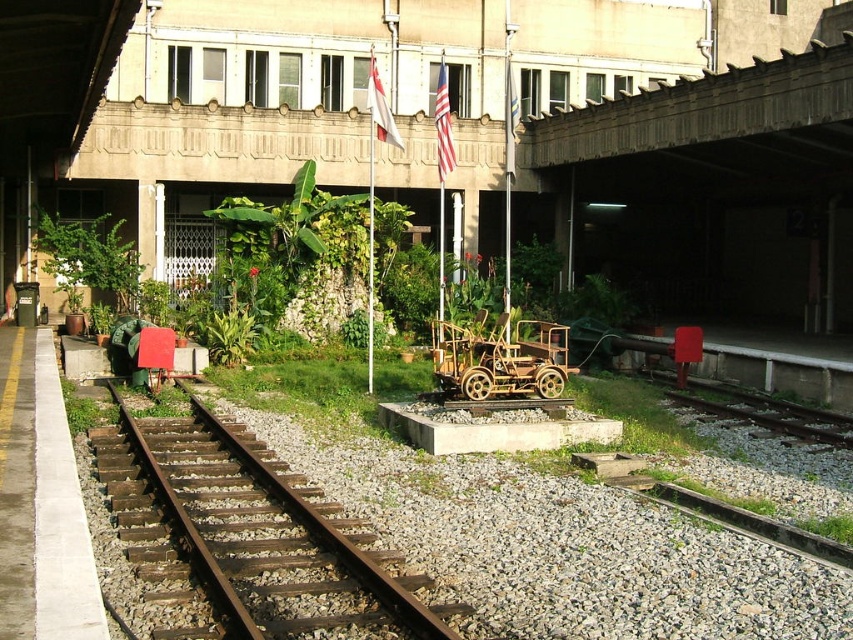
Is rusty metal train track at center positioned in front of concrete textured overpass at upper center?

Yes, it is in front of concrete textured overpass at upper center.

Consider the image. Can you confirm if rusty metal train track at center is positioned to the left of concrete textured overpass at upper center?

Indeed, rusty metal train track at center is positioned on the left side of concrete textured overpass at upper center.

Identify the location of rusty metal train track at center. The image size is (853, 640). (262, 532).

I want to click on rusty metal train track at center, so click(x=262, y=532).

Can you confirm if concrete textured overpass at upper center is smaller than wooden cart at center?

No.

Between concrete textured overpass at upper center and wooden cart at center, which one appears on the right side from the viewer's perspective?

concrete textured overpass at upper center is more to the right.

What do you see at coordinates (701, 109) in the screenshot?
I see `concrete textured overpass at upper center` at bounding box center [701, 109].

This screenshot has height=640, width=853. Identify the location of concrete textured overpass at upper center. (701, 109).

Consider the image. Which is more to the right, rusty metal train track at center or wooden cart at center?

From the viewer's perspective, wooden cart at center appears more on the right side.

Looking at this image, who is more distant from viewer, (306, 632) or (508, 388)?

Point (508, 388)

Image resolution: width=853 pixels, height=640 pixels. Find the location of `rusty metal train track at center`. rusty metal train track at center is located at coordinates (262, 532).